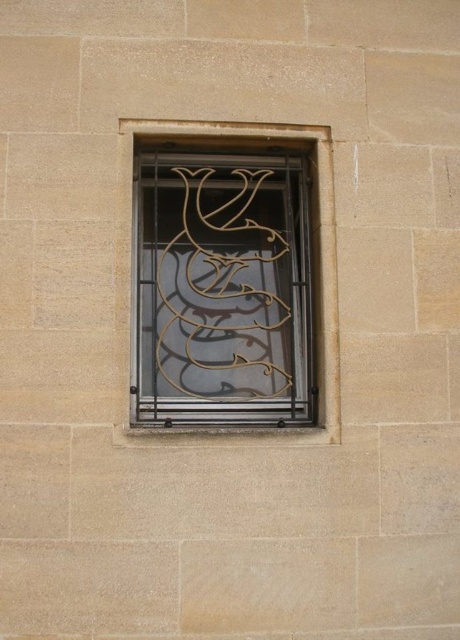
Can you confirm if gold wrought iron at center is positioned below metallic wire at center?

No.

Between gold wrought iron at center and metallic wire at center, which one appears on the left side from the viewer's perspective?

gold wrought iron at center is more to the left.

From the picture: Who is more distant from viewer, (179, 317) or (127, 294)?

Answer: The point (179, 317) is more distant.

Locate an element on the screen. gold wrought iron at center is located at coordinates (220, 291).